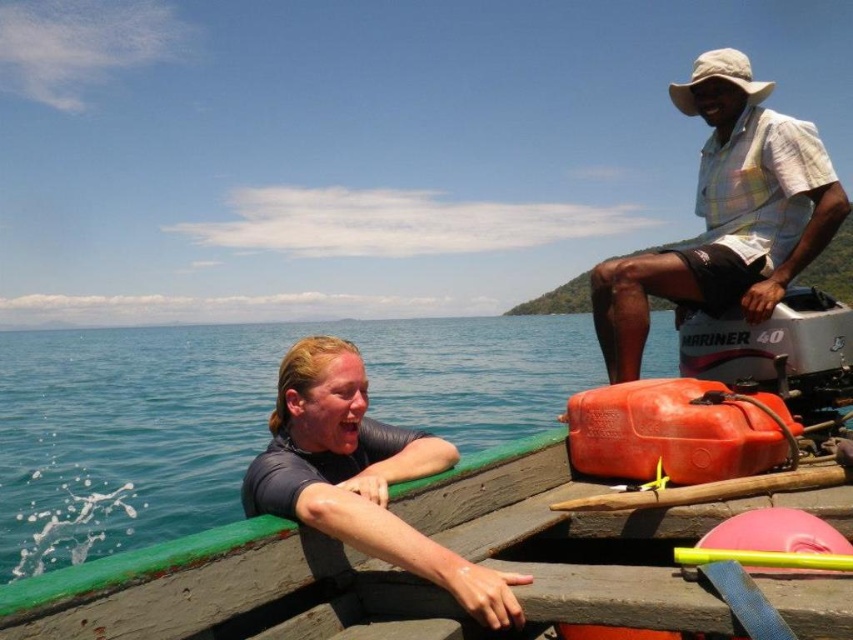
Is green wood boat at center closer to camera compared to white checkered shirt at upper right?

Yes, it is in front of white checkered shirt at upper right.

Where is `green wood boat at center`? The image size is (853, 640). green wood boat at center is located at coordinates (485, 516).

Locate an element on the screen. The height and width of the screenshot is (640, 853). green wood boat at center is located at coordinates (485, 516).

Who is more distant from viewer, (706, 196) or (276, 474)?

The point (706, 196) is more distant.

Does white checkered shirt at upper right have a greater width compared to dark gray wetsuit at left?

Yes.

Describe the element at coordinates (726, 216) in the screenshot. I see `white checkered shirt at upper right` at that location.

Locate an element on the screen. This screenshot has height=640, width=853. white checkered shirt at upper right is located at coordinates (726, 216).

Is point (358, 397) farther from camera compared to point (436, 556)?

Yes, it is.

What do you see at coordinates (485, 516) in the screenshot? This screenshot has width=853, height=640. I see `green wood boat at center` at bounding box center [485, 516].

I want to click on green wood boat at center, so click(485, 516).